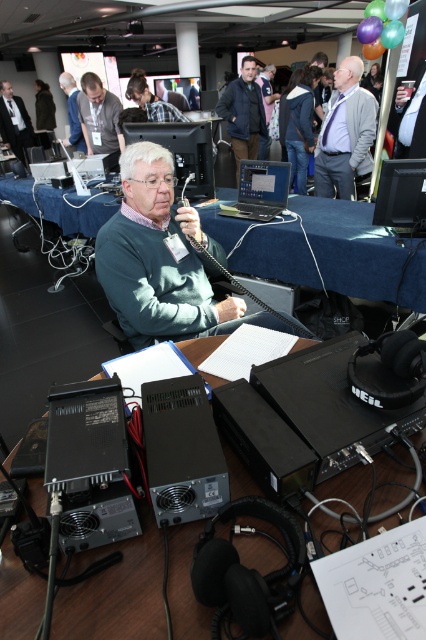
You are standing in the conference room and want to find the green matte sweater at center. According to the coordinates provided, where would you look to find it?

The green matte sweater at center is located at the 2D coordinates point (164, 260).

You are a photographer taking a photo of the scene. You notice the green matte sweater at center and the matte black sweater at center. Which sweater is closer to the camera?

The green matte sweater at center is positioned under the matte black sweater at center, so the matte black sweater at center is closer to the camera.